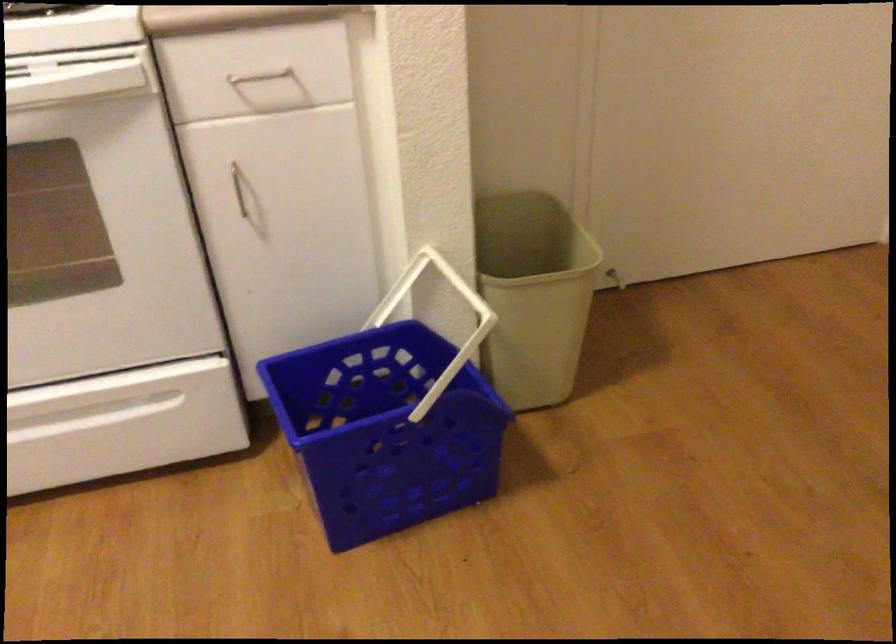
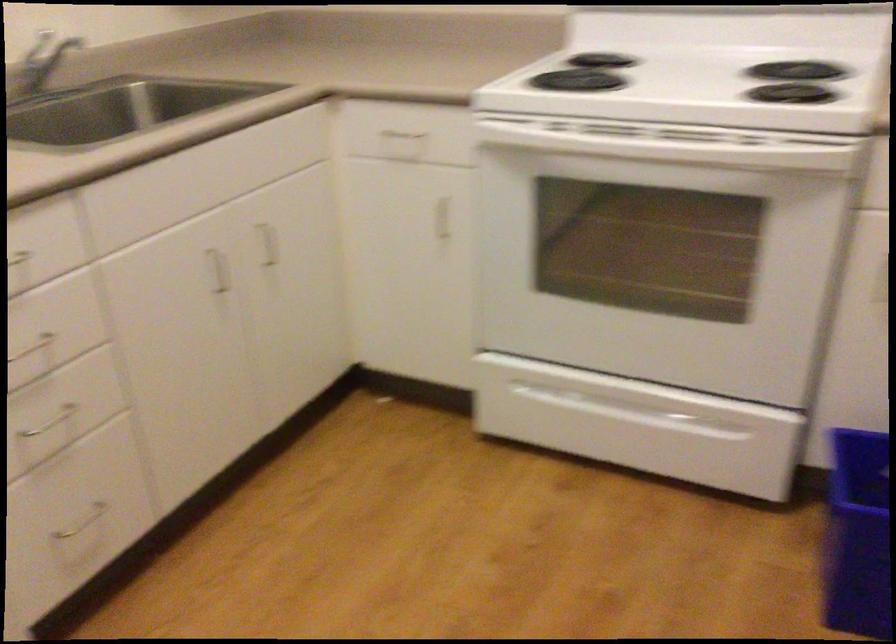
Question: Based on the continuous images, in which direction is the camera rotating? Reply with the corresponding letter.

Choices:
 (A) Left
 (B) Right
 (C) Up
 (D) Down

Answer: (A)